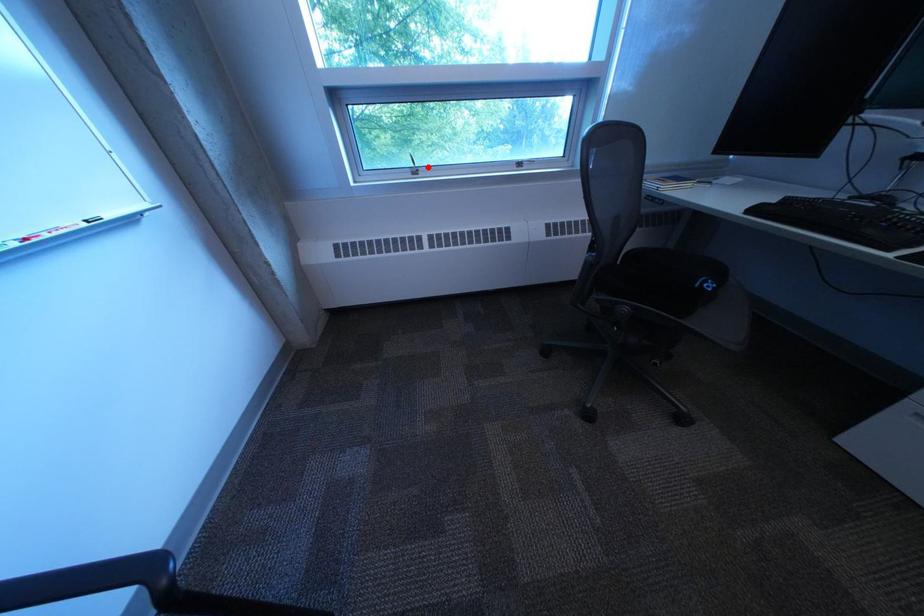
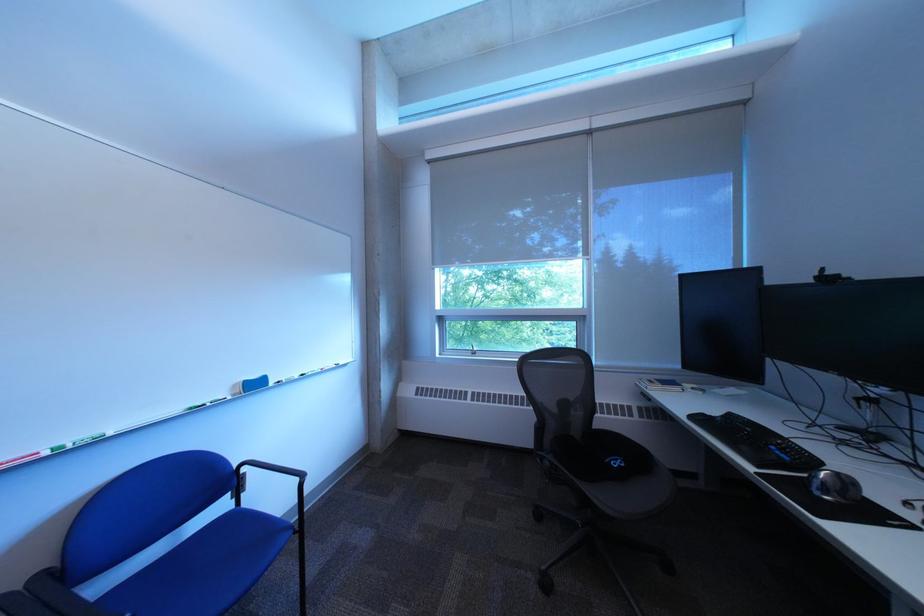
Question: I am providing you with two images of the same scene from different viewpoints. Image1 has a red point marked. In image2, the corresponding 3D location appears at what relative position? Reply with the corresponding letter.

Choices:
 (A) Closer
 (B) Farther

Answer: (A)